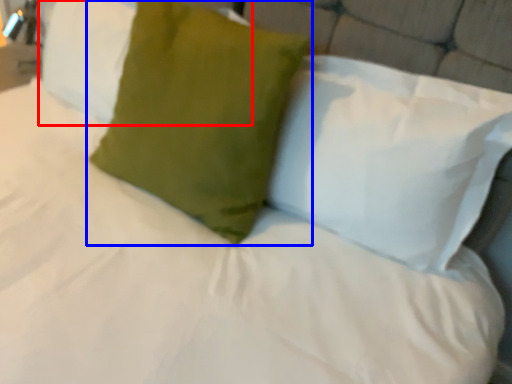
Question: Which object is further to the camera taking this photo, pillow (highlighted by a red box) or pillow (highlighted by a blue box)?

Choices:
 (A) pillow
 (B) pillow

Answer: (A)